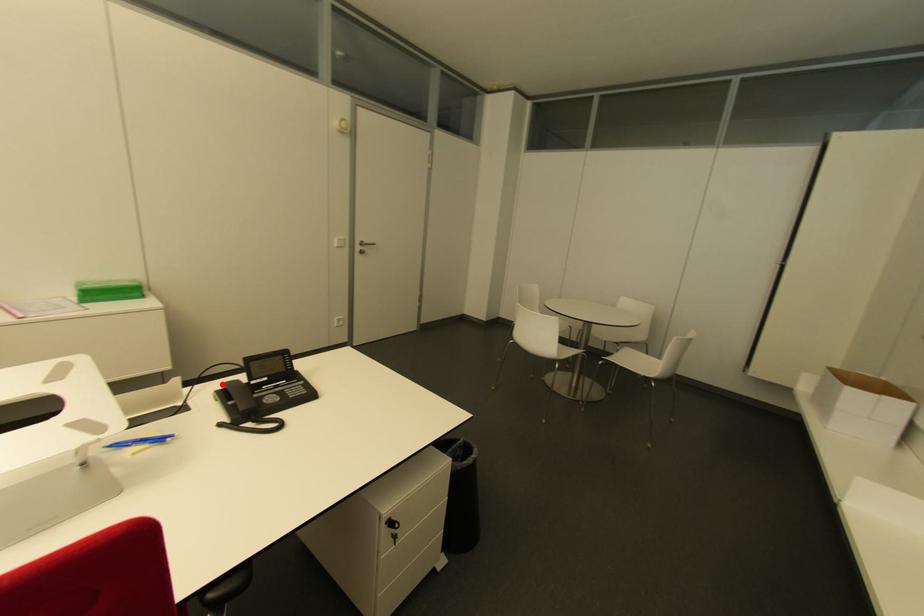
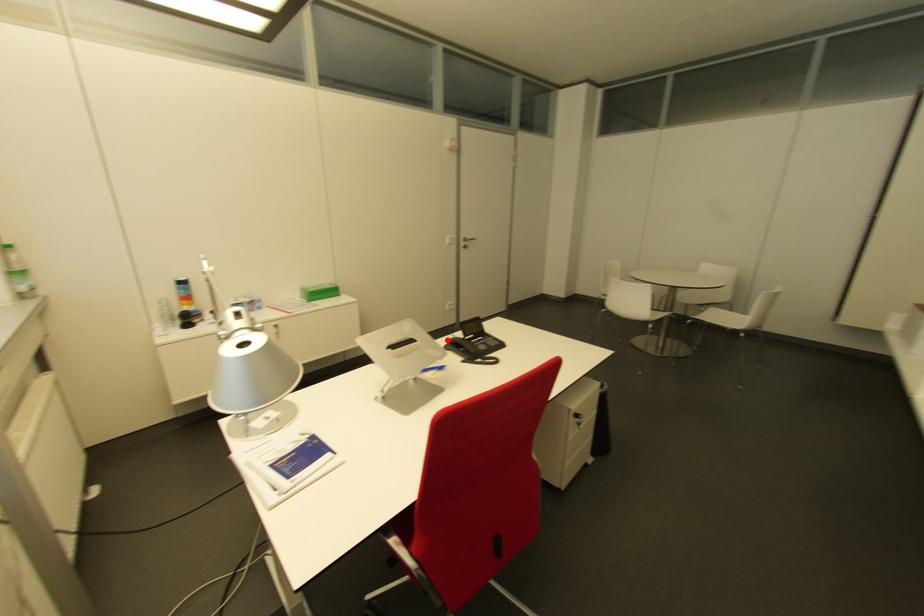
I am providing you with two images of the same scene from different viewpoints. A red point is marked on the first image and another point is marked on the second image. Are the points marked in image1 and image2 representing the same 3D position?

Yes